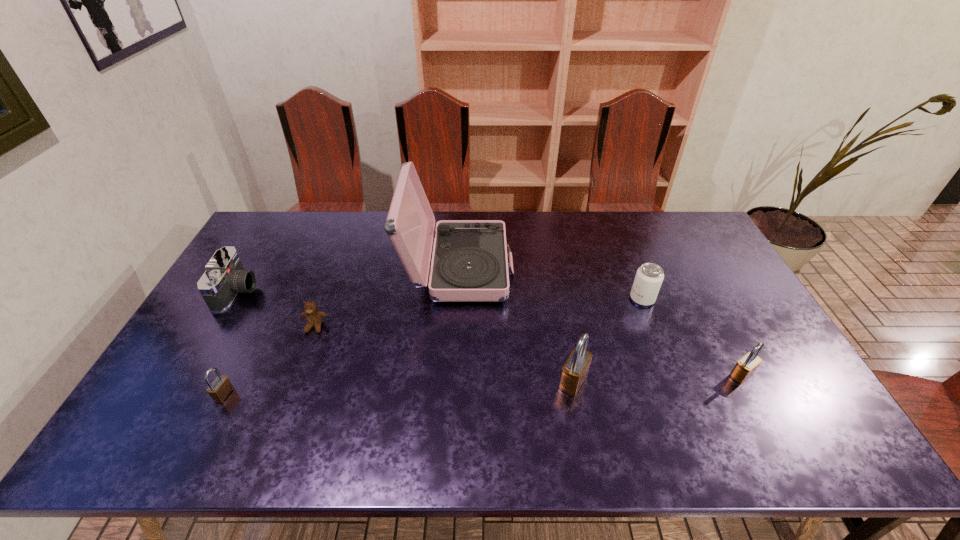
If equal spacing is the goal by inserting an additional padlock among them, please point out a vacant space for this new padlock. Please provide its 2D coordinates. Your answer should be formatted as a tuple, i.e. [(x, y)], where the tuple contains the x and y coordinates of a point satisfying the conditions above.

[(401, 388)]